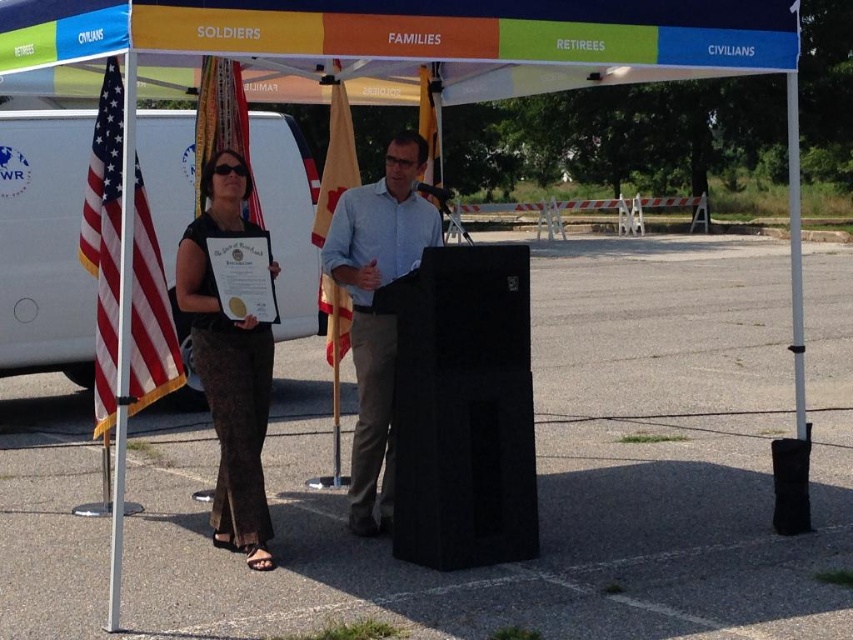
Question: Estimate the real-world distances between objects in this image. Which object is farther from the american flag at left?

Choices:
 (A) matte black dress at center
 (B) silky fabric flag at center

Answer: (B)

Question: Which point is closer to the camera?

Choices:
 (A) (x=166, y=264)
 (B) (x=390, y=339)
 (C) (x=439, y=147)

Answer: (B)

Question: Does matte black dress at center appear on the left side of american flag at left?

Choices:
 (A) no
 (B) yes

Answer: (A)

Question: Does orange fabric canopy at center lie behind american flag at left?

Choices:
 (A) yes
 (B) no

Answer: (B)

Question: Which point is farther to the camera?

Choices:
 (A) (292, 288)
 (B) (430, 99)
 (C) (653, 35)
 (D) (328, 157)

Answer: (A)

Question: Can you confirm if matte black dress at center is positioned above light blue shirt at center?

Choices:
 (A) yes
 (B) no

Answer: (B)